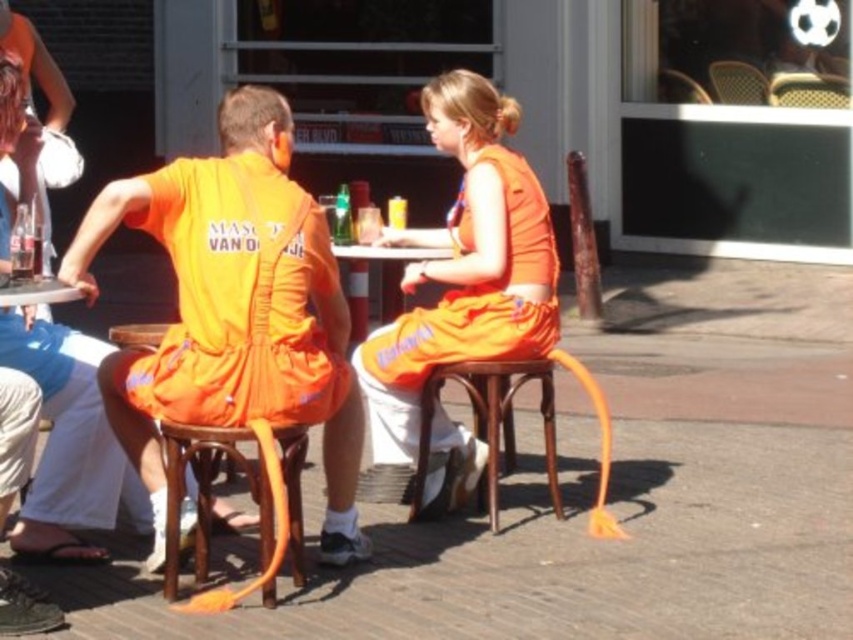
Looking at this image, you are standing in front of the outdoor table and want to place a small object on the table. The table has two specific points marked as point 1 and point 2. Point 1 is at coordinate (776, 81) and point 2 is at (756, 88). Which point is closer to you if you are facing the table directly?

Point 1 at coordinate (776, 81) is closer to the viewer than point 2 at (756, 88).

You are taking a photo of two people sitting at an outdoor table. There are two points marked in the image, point (531, 243) and point (546, 458). Which point is closer to the camera?

Point (531, 243) is closer to the camera than point (546, 458).

You are a photographer at the scene and want to capture a photo where both the matte orange dress at left and the matte glass bottle at left are clearly visible. Since the dress is taller, where should you position the camera relative to the table to ensure both objects are fully in frame?

Since the matte orange dress at left is taller than the matte glass bottle at left, positioning the camera slightly above the table level would allow both objects to be fully visible in the photo without any obstruction from their height difference.